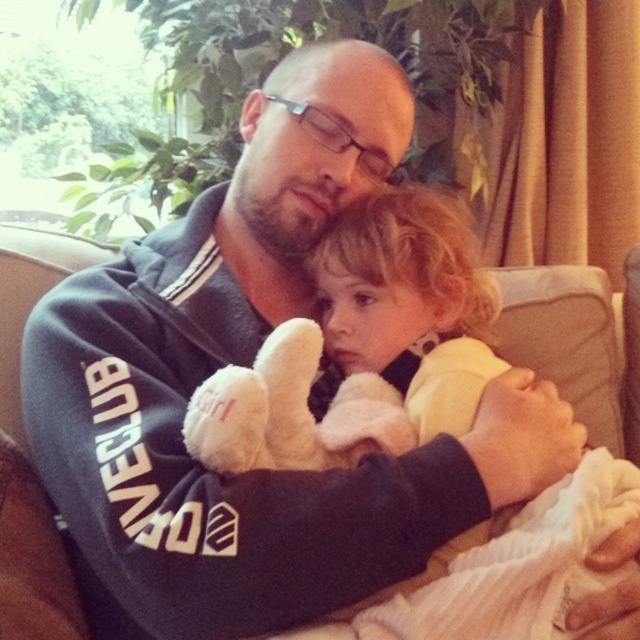
Question: From the image, what is the correct spatial relationship of soft white teddy bear at center in relation to white plush toy at center?

Choices:
 (A) below
 (B) above

Answer: (B)

Question: Is soft white teddy bear at center to the right of white plush toy at center from the viewer's perspective?

Choices:
 (A) no
 (B) yes

Answer: (B)

Question: Which object appears closest to the camera in this image?

Choices:
 (A) soft white teddy bear at center
 (B) white plush toy at center

Answer: (B)

Question: Which point is closer to the camera?

Choices:
 (A) white plush toy at center
 (B) soft white teddy bear at center

Answer: (A)

Question: Is soft white teddy bear at center positioned before white plush toy at center?

Choices:
 (A) no
 (B) yes

Answer: (A)